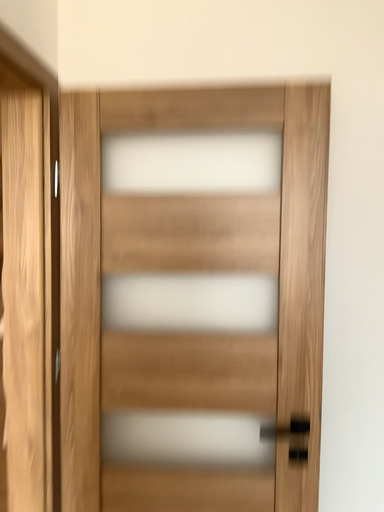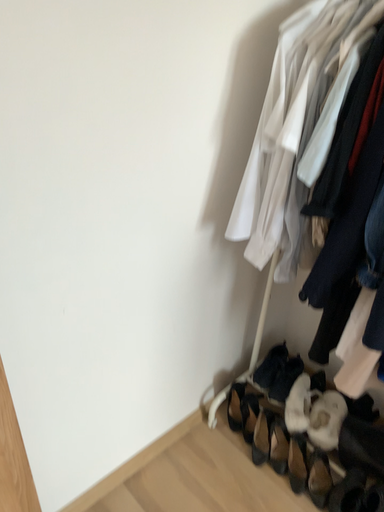
Question: Which way did the camera rotate in the video?

Choices:
 (A) rotated upward
 (B) rotated downward

Answer: (B)